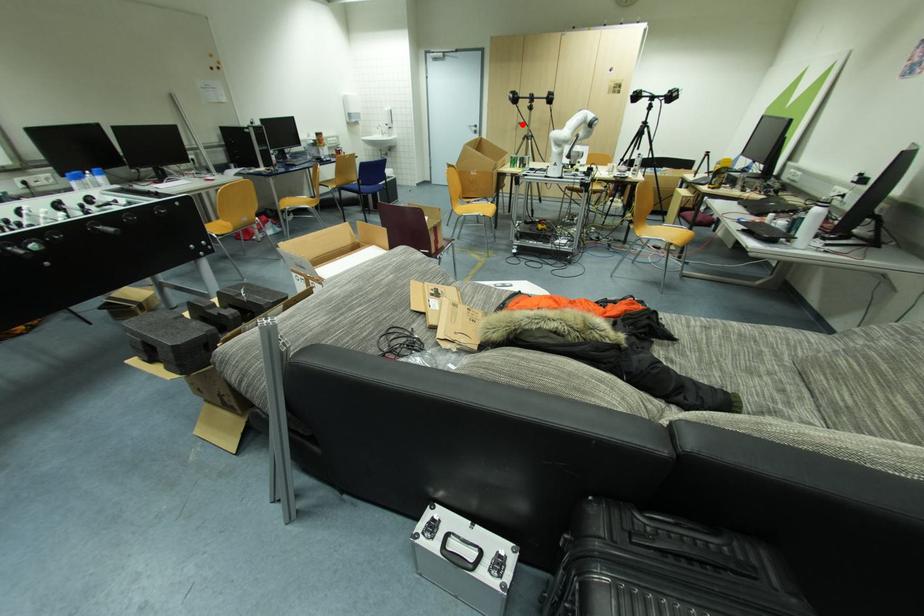
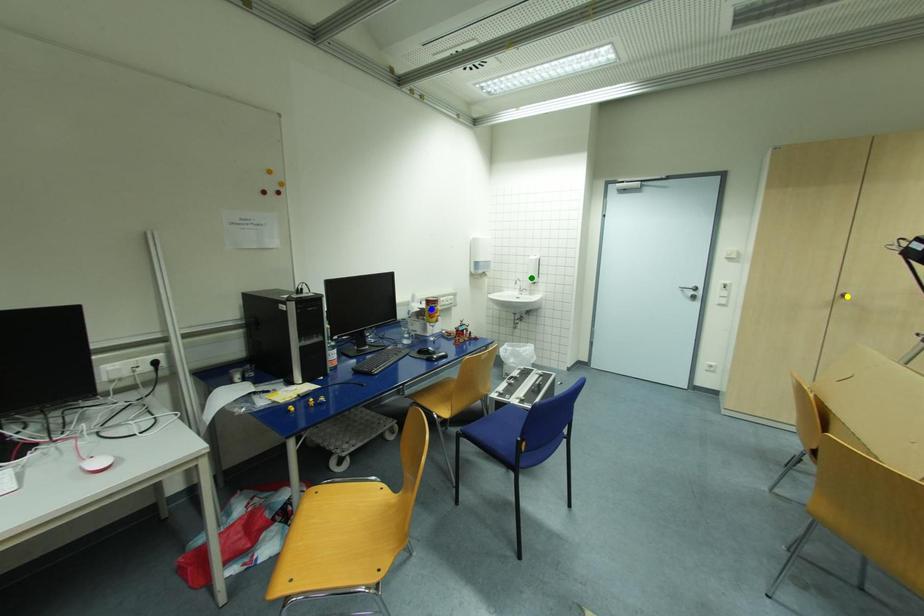
Question: I am providing you with two images of the same scene from different viewpoints. A red point is marked on the first image. You are given multiple points on the second image. Which mark in image 2 goes with the point in image 1?

Choices:
 (A) green point
 (B) blue point
 (C) yellow point

Answer: (C)